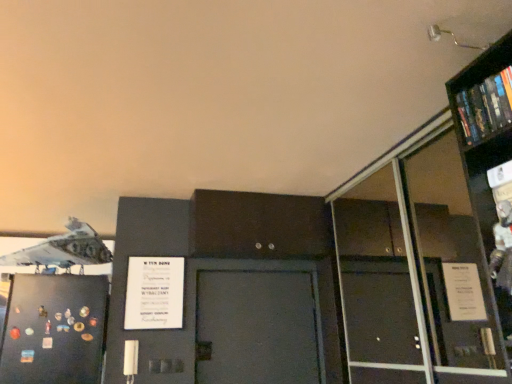
Question: Is white matte airplane at upper left aimed at hardcover book at upper right?

Choices:
 (A) yes
 (B) no

Answer: (B)

Question: Can you confirm if white matte airplane at upper left is smaller than hardcover book at upper right?

Choices:
 (A) no
 (B) yes

Answer: (A)

Question: From the image's perspective, is white matte airplane at upper left under hardcover book at upper right?

Choices:
 (A) no
 (B) yes

Answer: (B)

Question: Considering the relative sizes of white matte airplane at upper left and hardcover book at upper right in the image provided, is white matte airplane at upper left bigger than hardcover book at upper right?

Choices:
 (A) yes
 (B) no

Answer: (A)

Question: Considering the relative sizes of white matte airplane at upper left and hardcover book at upper right in the image provided, is white matte airplane at upper left wider than hardcover book at upper right?

Choices:
 (A) no
 (B) yes

Answer: (B)

Question: From the image's perspective, is white matte airplane at upper left above or below transparent glass bookcase at upper right?

Choices:
 (A) above
 (B) below

Answer: (A)

Question: From a real-world perspective, is white matte airplane at upper left positioned above or below transparent glass bookcase at upper right?

Choices:
 (A) above
 (B) below

Answer: (A)

Question: Is white matte airplane at upper left wider or thinner than transparent glass bookcase at upper right?

Choices:
 (A) thin
 (B) wide

Answer: (B)

Question: Based on their sizes in the image, would you say white matte airplane at upper left is bigger or smaller than transparent glass bookcase at upper right?

Choices:
 (A) small
 (B) big

Answer: (B)

Question: In terms of size, does white paper poster at center appear bigger or smaller than hardcover book at upper right?

Choices:
 (A) small
 (B) big

Answer: (B)

Question: Looking at their shapes, would you say white paper poster at center is wider or thinner than hardcover book at upper right?

Choices:
 (A) wide
 (B) thin

Answer: (B)

Question: Is white paper poster at center taller or shorter than hardcover book at upper right?

Choices:
 (A) short
 (B) tall

Answer: (B)

Question: From a real-world perspective, is white paper poster at center positioned above or below hardcover book at upper right?

Choices:
 (A) below
 (B) above

Answer: (A)

Question: Considering the positions of white paper poster at center and transparent glass bookcase at upper right in the image, is white paper poster at center taller or shorter than transparent glass bookcase at upper right?

Choices:
 (A) short
 (B) tall

Answer: (A)

Question: Considering the positions of white paper poster at center and transparent glass bookcase at upper right in the image, is white paper poster at center wider or thinner than transparent glass bookcase at upper right?

Choices:
 (A) wide
 (B) thin

Answer: (B)